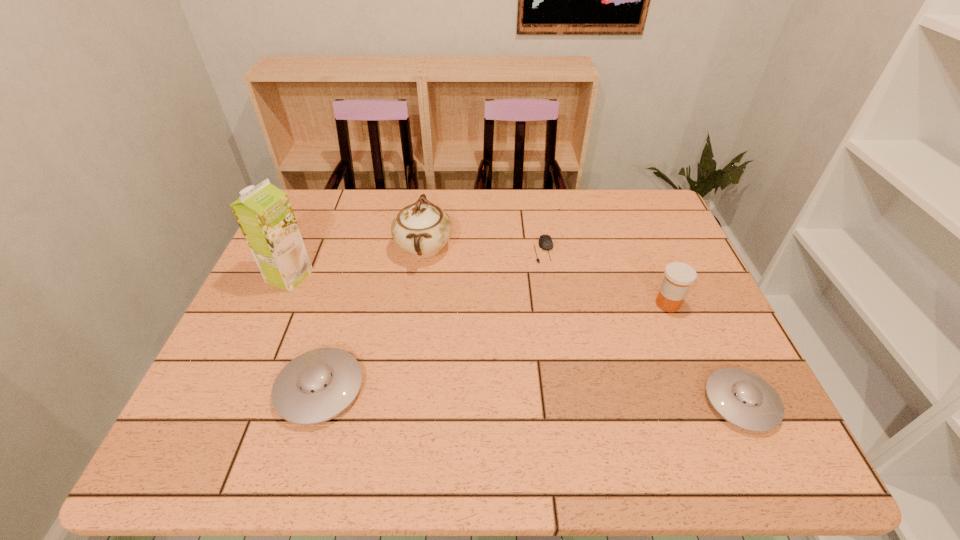
Identify the location of the tallest object. (264, 213).

Identify the location of the leftmost object. This screenshot has width=960, height=540. (264, 213).

You are a GUI agent. You are given a task and a screenshot of the screen. Output one action in this format:
    pyautogui.click(x=<x>, y=<y>)
    Task: Click on the vacant space positioned 0.090m on the back of the fourth tallest object
    
    Given the screenshot: What is the action you would take?
    pyautogui.click(x=340, y=324)

Find the location of a particular element. Image resolution: width=960 pixels, height=540 pixels. vacant position located 0.090m on the back of the fifth tallest object is located at coordinates (711, 340).

At what (x,y) coordinates should I click in order to perform the action: click on free region located 0.160m on the right of the second tallest object. Please return your answer as a coordinate pair (x, y). Image resolution: width=960 pixels, height=540 pixels. Looking at the image, I should click on (508, 248).

Find the location of a particular element. blank space located on the back of the third object from right to left is located at coordinates coord(536,197).

Image resolution: width=960 pixels, height=540 pixels. In order to click on blank space located on the label of the medicine in this screenshot , I will do `click(553, 304)`.

At what (x,y) coordinates should I click in order to perform the action: click on vacant space located on the label of the medicine. Please return your answer as a coordinate pair (x, y). This screenshot has width=960, height=540. Looking at the image, I should click on coord(572,304).

Find the location of `blank space located on the label of the medicine`. blank space located on the label of the medicine is located at coordinates (503, 304).

Locate an element on the screen. free spot located 0.130m on the right of the soya milk is located at coordinates (358, 276).